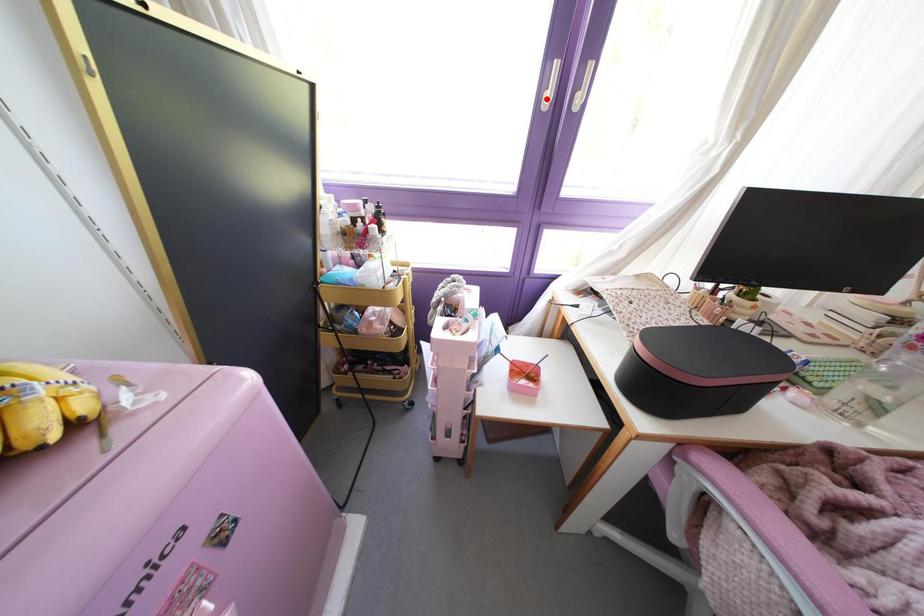
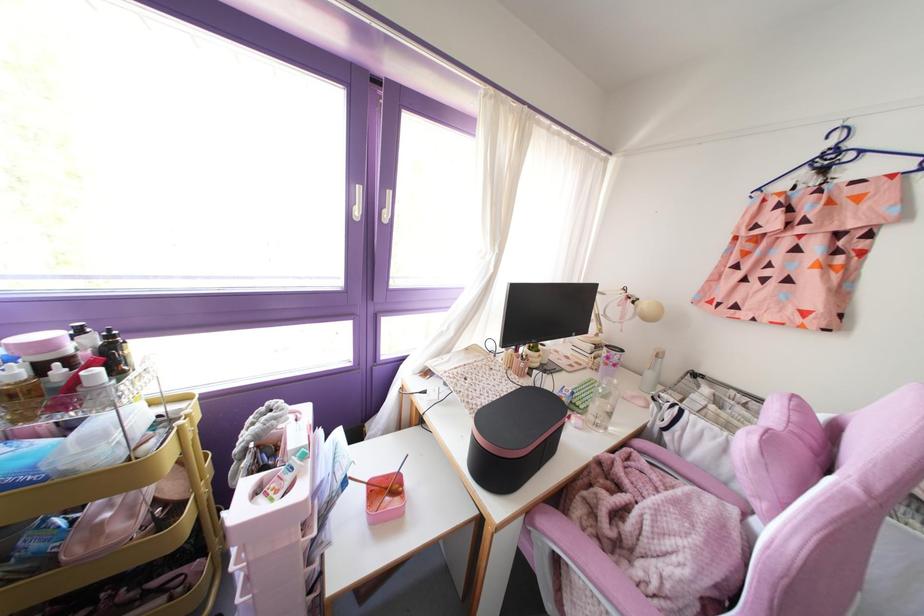
Locate, in the second image, the point that corresponds to the highlighted location in the first image.

(357, 212)